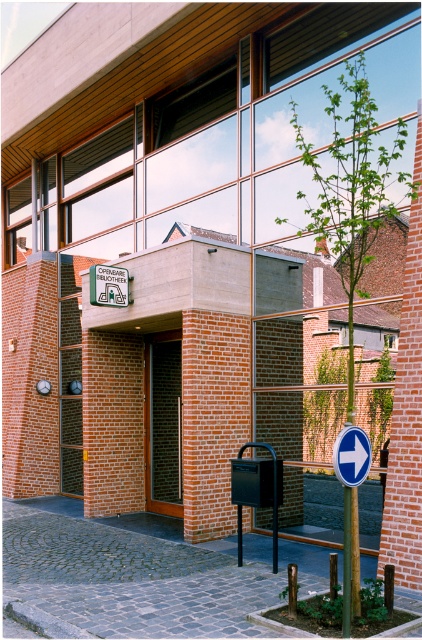
You are a delivery person holding a large package that requires a door wider than 1 meter to enter the building. You see the brown wooden door at center and the white plastic sign at lower right. Which object can accommodate your package?

The brown wooden door at center has a larger size compared to the white plastic sign at lower right, so the brown wooden door at center is the one that can accommodate the large package requiring a door wider than 1 meter.

You are standing at the entrance of the modern building and want to determine the relative positions of two points marked in the image. Which point is closer to you, point [175,488] or point [354,444]?

Point [175,488] is closer to you because it is further to the viewer than point [354,444].